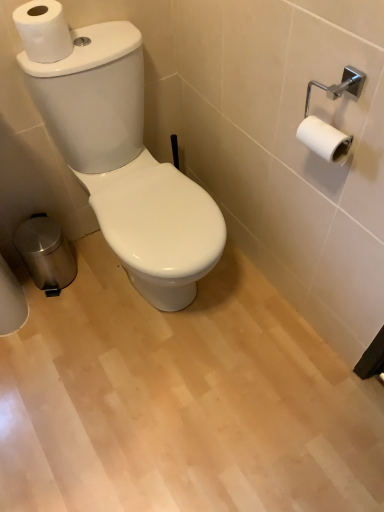
Identify the location of vacant area that lies between white glossy toilet at center and polished stainless steel trash bin at lower left. This screenshot has height=512, width=384. (103, 301).